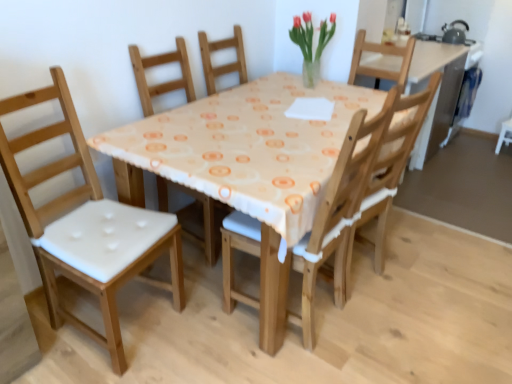
Question: Is white fabric chair at left, the 2th chair viewed from the right, next to wooden chair with white cushion at center, arranged as the 2th chair when viewed from the left, and touching it?

Choices:
 (A) yes
 (B) no

Answer: (B)

Question: Is white fabric chair at left, the 1th chair when ordered from left to right, bigger than wooden chair with white cushion at center, arranged as the 2th chair when viewed from the left?

Choices:
 (A) yes
 (B) no

Answer: (A)

Question: From the image's perspective, is white fabric chair at left, the 1th chair when ordered from left to right, located beneath wooden chair with white cushion at center, arranged as the 2th chair when viewed from the left?

Choices:
 (A) no
 (B) yes

Answer: (B)

Question: Considering the relative sizes of white fabric chair at left, the 1th chair when ordered from left to right, and wooden chair with white cushion at center, positioned as the 1th chair in right-to-left order, in the image provided, is white fabric chair at left, the 1th chair when ordered from left to right, taller than wooden chair with white cushion at center, positioned as the 1th chair in right-to-left order,?

Choices:
 (A) no
 (B) yes

Answer: (B)

Question: Is wooden chair with white cushion at center, arranged as the 2th chair when viewed from the left, located within white fabric chair at left, the 2th chair viewed from the right?

Choices:
 (A) no
 (B) yes

Answer: (A)

Question: Considering their positions, is white fabric chair at left, the 1th chair when ordered from left to right, located in front of or behind wooden chair with white cushion at center, arranged as the 2th chair when viewed from the left?

Choices:
 (A) behind
 (B) front

Answer: (B)

Question: From the image's perspective, is white fabric chair at left, the 2th chair viewed from the right, above or below wooden chair with white cushion at center, positioned as the 1th chair in right-to-left order?

Choices:
 (A) above
 (B) below

Answer: (B)

Question: Looking at their shapes, would you say white fabric chair at left, the 1th chair when ordered from left to right, is wider or thinner than wooden chair with white cushion at center, arranged as the 2th chair when viewed from the left?

Choices:
 (A) thin
 (B) wide

Answer: (A)

Question: From a real-world perspective, is white fabric chair at left, the 1th chair when ordered from left to right, above or below wooden chair with white cushion at center, arranged as the 2th chair when viewed from the left?

Choices:
 (A) below
 (B) above

Answer: (B)

Question: From a real-world perspective, is wooden chair with white cushion at center, arranged as the 2th chair when viewed from the left, physically located above or below translucent glass vase at upper center?

Choices:
 (A) below
 (B) above

Answer: (A)

Question: Relative to translucent glass vase at upper center, is wooden chair with white cushion at center, arranged as the 2th chair when viewed from the left, in front or behind?

Choices:
 (A) front
 (B) behind

Answer: (A)

Question: Is wooden chair with white cushion at center, arranged as the 2th chair when viewed from the left, wider or thinner than translucent glass vase at upper center?

Choices:
 (A) thin
 (B) wide

Answer: (B)

Question: Does point (381, 122) appear closer or farther from the camera than point (318, 54)?

Choices:
 (A) farther
 (B) closer

Answer: (B)

Question: In the image, is white fabric chair at left, the 1th chair when ordered from left to right, positioned in front of or behind translucent glass vase at upper center?

Choices:
 (A) front
 (B) behind

Answer: (A)

Question: Is white fabric chair at left, the 1th chair when ordered from left to right, to the left or to the right of translucent glass vase at upper center in the image?

Choices:
 (A) right
 (B) left

Answer: (B)